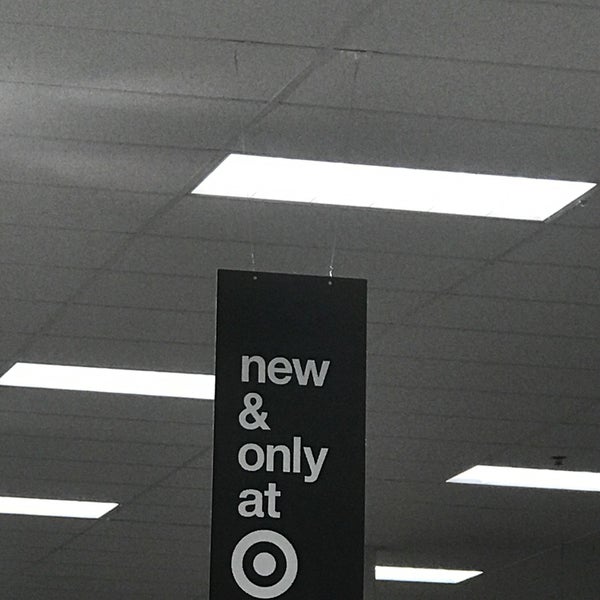
The height and width of the screenshot is (600, 600). Identify the location of sign hanging. (311, 297).